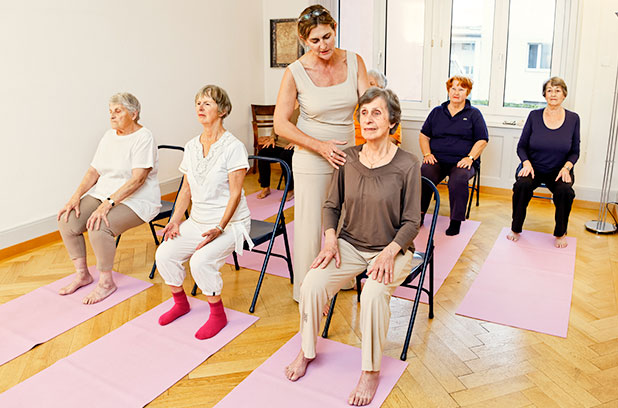
Find the location of `mats`. mats is located at coordinates (523, 272), (439, 243), (292, 229), (259, 212), (83, 351), (25, 318), (271, 369).